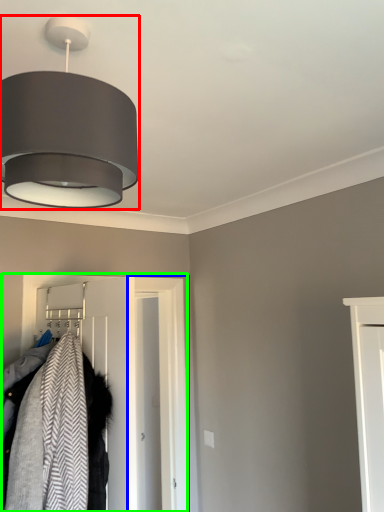
Question: Estimate the real-world distances between objects in this image. Which object is closer to lamp (highlighted by a red box), door (highlighted by a blue box) or closet (highlighted by a green box)?

Choices:
 (A) door
 (B) closet

Answer: (B)